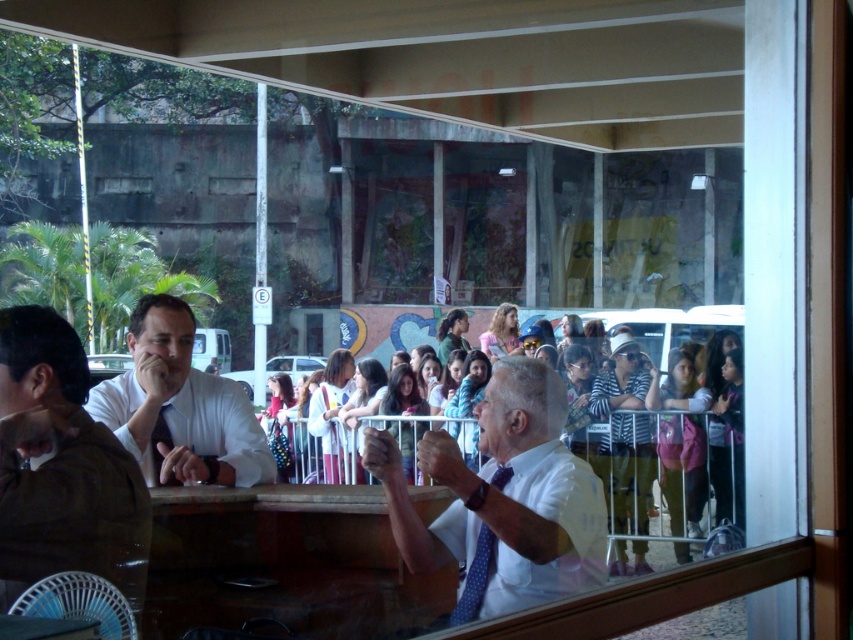
Question: Among these objects, which one is nearest to the camera?

Choices:
 (A) white shirt at center
 (B) blue dotted tie at center

Answer: (A)

Question: Is white polka dot tie at center closer to the viewer compared to white matte shirt at left?

Choices:
 (A) no
 (B) yes

Answer: (B)

Question: Which point is closer to the camera taking this photo?

Choices:
 (A) (73, 541)
 (B) (450, 614)

Answer: (A)

Question: Which is farther from the matte black tie at center?

Choices:
 (A) blue dotted tie at center
 (B) white polka dot tie at center
 (C) white shirt at center
 (D) white matte shirt at left

Answer: (C)

Question: Is white matte shirt at left bigger than matte black tie at center?

Choices:
 (A) no
 (B) yes

Answer: (B)

Question: In this image, where is white polka dot tie at center located relative to white matte shirt at left?

Choices:
 (A) left
 (B) right

Answer: (B)